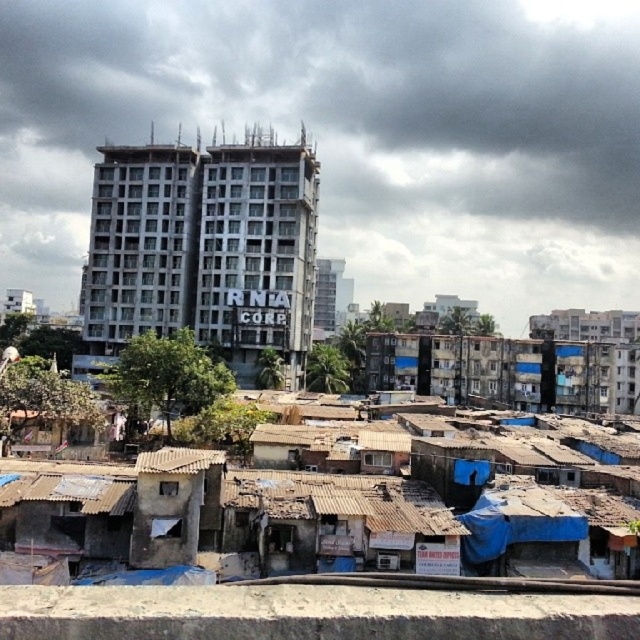
This screenshot has width=640, height=640. Describe the element at coordinates (349, 132) in the screenshot. I see `white concrete building at center` at that location.

Can you confirm if white concrete building at center is positioned below concrete building at center?

No, white concrete building at center is not below concrete building at center.

Which is behind, point (28, 72) or point (100, 358)?

Positioned behind is point (28, 72).

You are a GUI agent. You are given a task and a screenshot of the screen. Output one action in this format:
    pyautogui.click(x=<x>, y=<y>)
    Task: Click on the white concrete building at center
    The height and width of the screenshot is (640, 640).
    Given the screenshot: What is the action you would take?
    pyautogui.click(x=349, y=132)

Consider the image. Does concrete building at center have a larger size compared to rusty concrete slum at lower center?

Indeed, concrete building at center has a larger size compared to rusty concrete slum at lower center.

Who is more distant from viewer, [106,349] or [330,605]?

Positioned behind is point [106,349].

At what (x,y) coordinates should I click in order to perform the action: click on concrete building at center. Please return your answer as a coordinate pair (x, y). Looking at the image, I should click on pos(204,250).

Who is taller, white concrete building at center or rusty concrete slum at lower center?

Standing taller between the two is white concrete building at center.

Who is more distant from viewer, [26,74] or [435,632]?

The point [26,74] is more distant.

This screenshot has height=640, width=640. Identify the location of white concrete building at center. (349, 132).